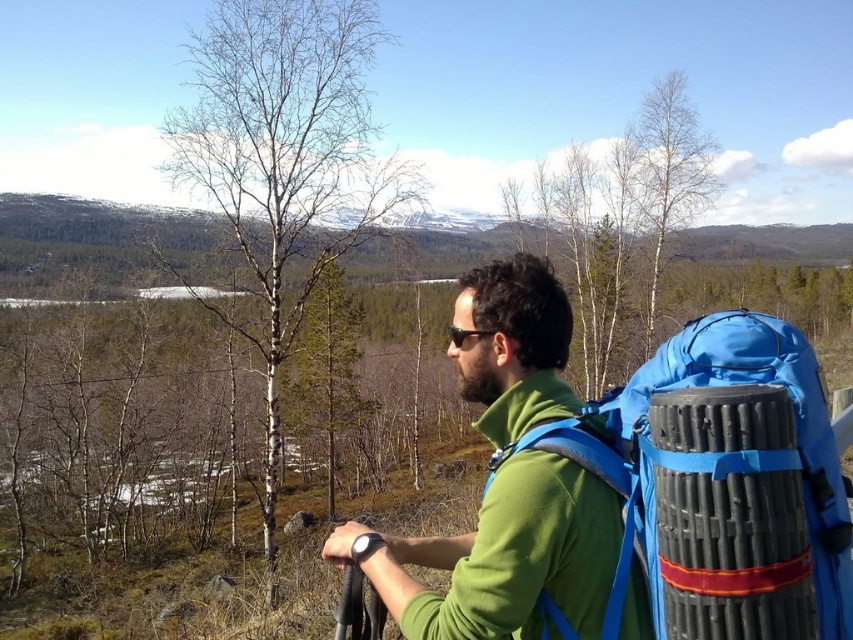
Does green matte jacket at center have a lesser height compared to black plastic sunglasses at center?

In fact, green matte jacket at center may be taller than black plastic sunglasses at center.

Who is more distant from viewer, (515,417) or (473,330)?

The point (473,330) is behind.

Image resolution: width=853 pixels, height=640 pixels. Identify the location of green matte jacket at center. (502, 556).

Does green matte jacket at center come behind blue fabric backpack at center-right?

That is True.

Which is behind, point (606, 579) or point (630, 499)?

The point (630, 499) is more distant.

The image size is (853, 640). In order to click on green matte jacket at center in this screenshot , I will do `click(502, 556)`.

Can you confirm if blue fabric backpack at center-right is positioned above black plastic sunglasses at center?

Incorrect, blue fabric backpack at center-right is not positioned above black plastic sunglasses at center.

Who is more distant from viewer, [605,420] or [451,332]?

The point [451,332] is more distant.

Who is more forward, (651, 548) or (456, 330)?

Positioned in front is point (651, 548).

Locate an element on the screen. blue fabric backpack at center-right is located at coordinates (x=712, y=452).